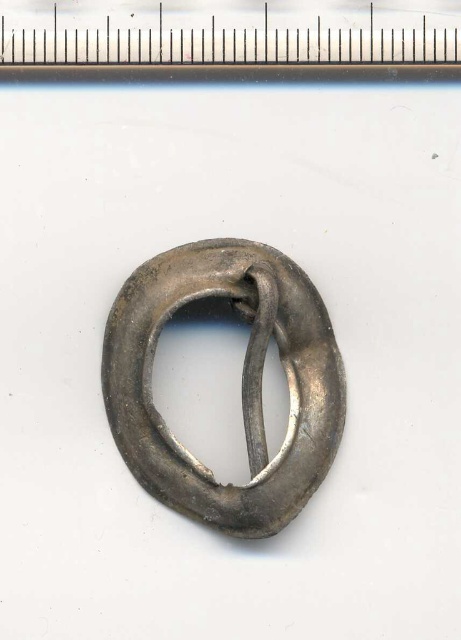
You are an engineer analyzing the placement of the shiny silver ring at center in the image. Based on the coordinates provided, can you determine if the ring is positioned closer to the top or bottom edge of the image?

The coordinates of the shiny silver ring at center are at point (242, 381). Since the y coordinate is 0.525, which is above the midpoint of the image height, the ring is positioned closer to the top edge of the image.

You are an appraiser examining the shiny silver ring at center and the metallic ruler at upper center. Which object is located closer to the bottom of the image?

The shiny silver ring at center is positioned under the metallic ruler at upper center, so it is closer to the bottom of the image.

You are an appraiser examining the shiny silver ring at center and the metallic ruler at upper center in the image. Which object is closer to the viewer?

The shiny silver ring at center is closer to the viewer because the metallic ruler at upper center is behind it.